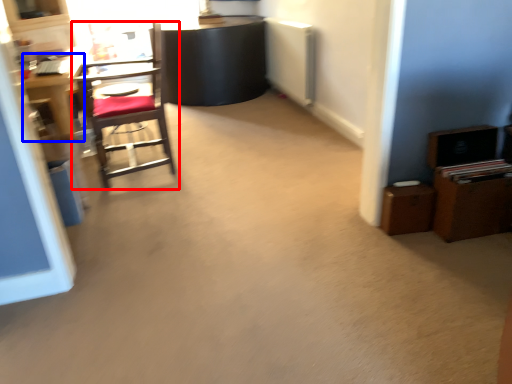
Question: Among these objects, which one is nearest to the camera, chair (highlighted by a red box) or desk (highlighted by a blue box)?

Choices:
 (A) chair
 (B) desk

Answer: (A)